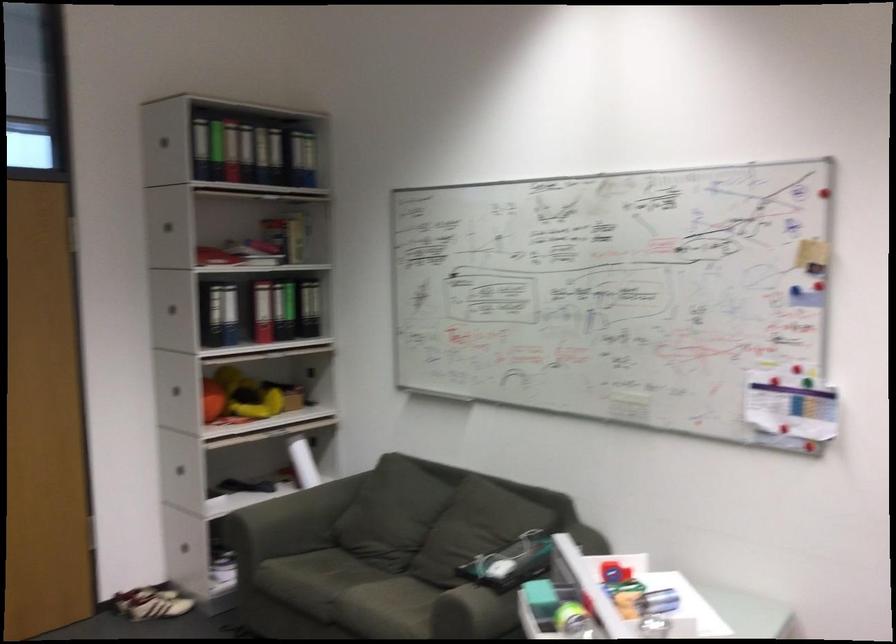
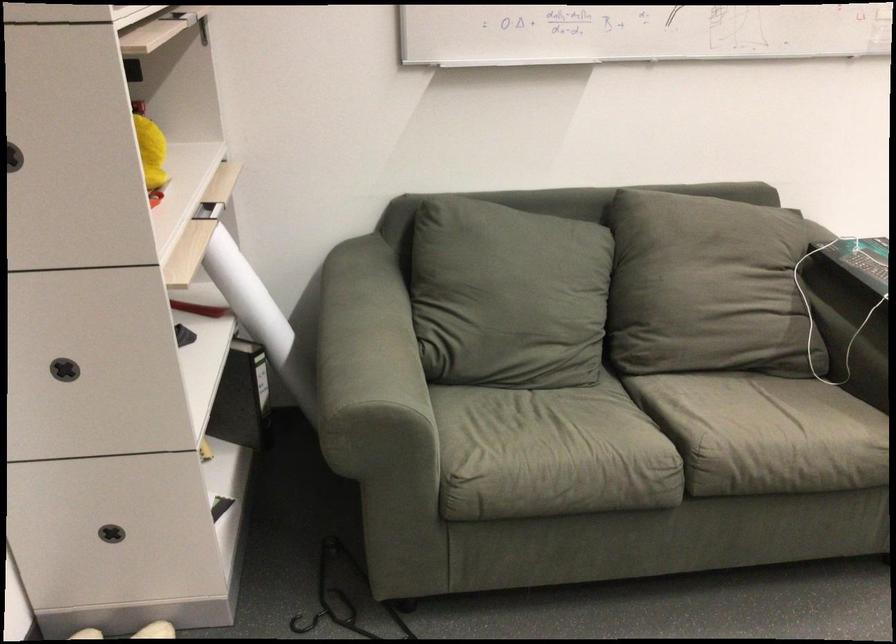
In the second image, find the point that corresponds to point 271,411 in the first image.

(151, 152)